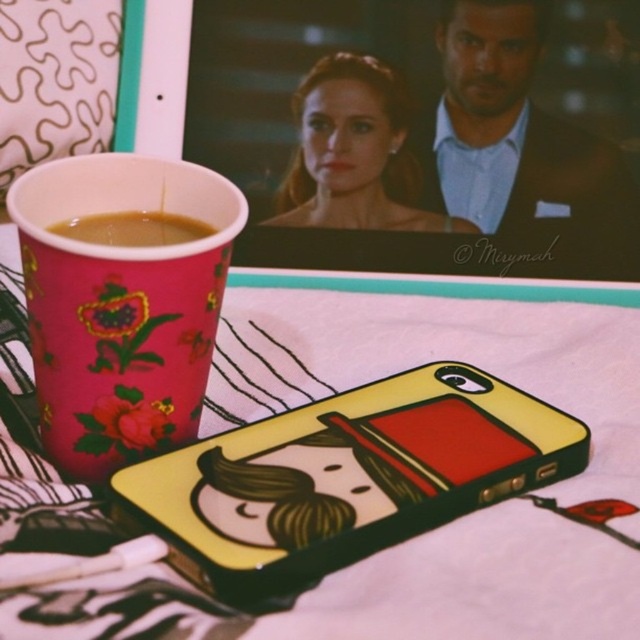
From the picture: Between matte black suit at upper right and brown matte cup at left, which one has less height?

Standing shorter between the two is brown matte cup at left.

This screenshot has width=640, height=640. In order to click on matte black suit at upper right in this screenshot , I will do `click(518, 147)`.

Is point (419, 144) farther from viewer compared to point (122, 212)?

Yes.

You are a GUI agent. You are given a task and a screenshot of the screen. Output one action in this format:
    pyautogui.click(x=<x>, y=<y>)
    Task: Click on the matte black suit at upper right
    The height and width of the screenshot is (640, 640).
    Given the screenshot: What is the action you would take?
    pyautogui.click(x=518, y=147)

Consider the image. Does yellow matte phone case at center have a lesser height compared to matte black hair at center?

Yes.

Does yellow matte phone case at center have a greater width compared to matte black hair at center?

Yes.

Is point (310, 483) positioned before point (380, 202)?

Yes.

Where is `yellow matte phone case at center`? The height and width of the screenshot is (640, 640). yellow matte phone case at center is located at coordinates (348, 476).

Can you confirm if pink paper cup at left is bigger than matte black hair at center?

Yes, pink paper cup at left is bigger than matte black hair at center.

Is pink paper cup at left below matte black hair at center?

Correct, pink paper cup at left is located below matte black hair at center.

The width and height of the screenshot is (640, 640). What do you see at coordinates (122, 300) in the screenshot? I see `pink paper cup at left` at bounding box center [122, 300].

Identify the location of pink paper cup at left. This screenshot has height=640, width=640. (122, 300).